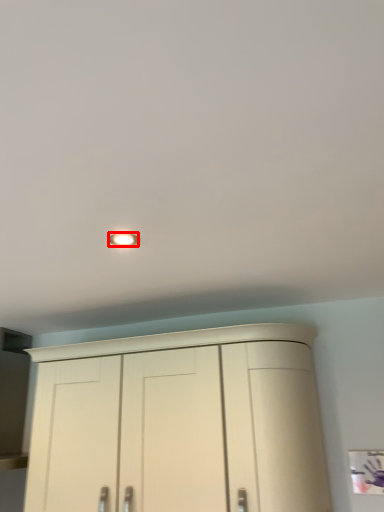
Question: From the image's perspective, where is lighting (annotated by the red box) located in relation to cupboard in the image?

Choices:
 (A) below
 (B) above

Answer: (B)